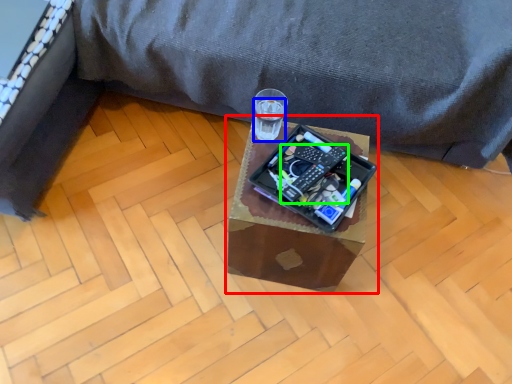
Question: Which object is the closest to the table (highlighted by a red box)? Choose among these: beverage (highlighted by a blue box) or gadget (highlighted by a green box).

Choices:
 (A) beverage
 (B) gadget

Answer: (B)